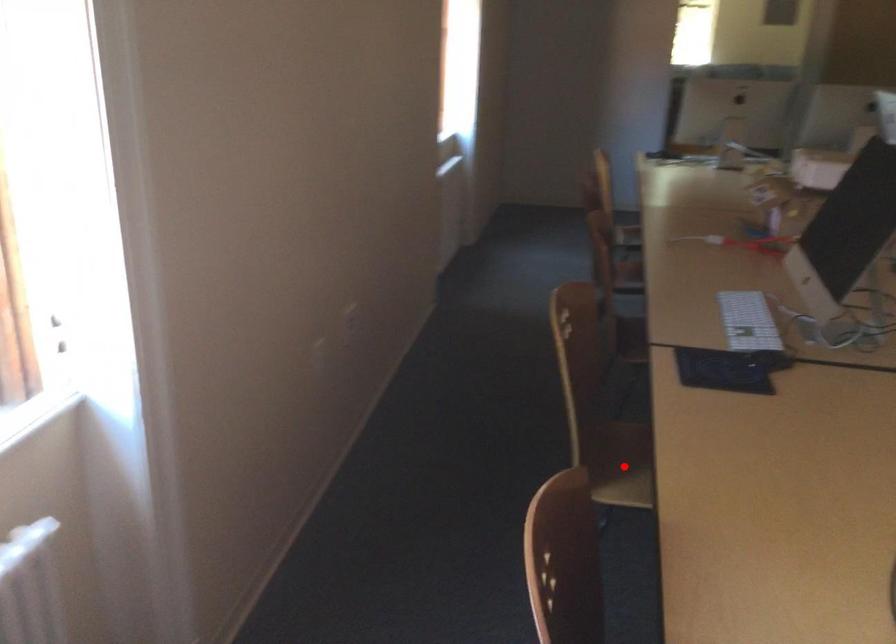
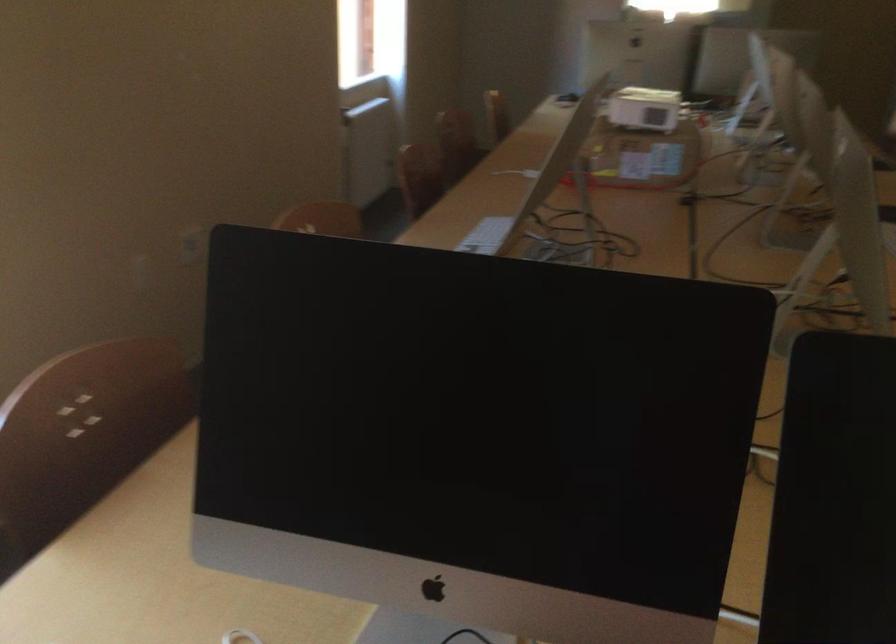
Question: I am providing you with two images of the same scene from different viewpoints. A red point is marked on the first image. Can you still see the location of the red point in image 2?

Choices:
 (A) Yes
 (B) No

Answer: (B)